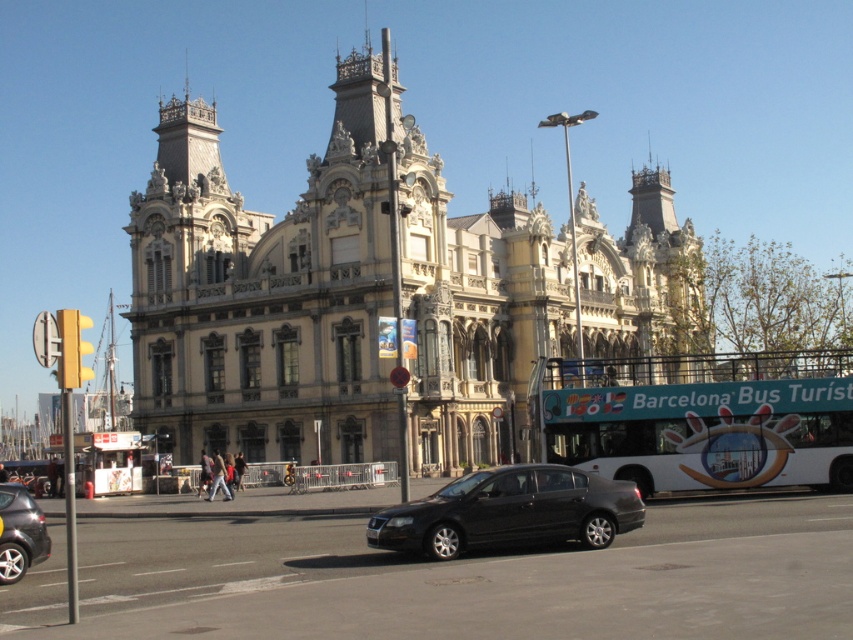
Question: Which point appears closest to the camera in this image?

Choices:
 (A) (692, 244)
 (B) (537, 472)
 (C) (9, 486)

Answer: (C)

Question: Can you confirm if stone textured building at center is positioned above matte black sedan at center?

Choices:
 (A) no
 (B) yes

Answer: (B)

Question: Estimate the real-world distances between objects in this image. Which object is farther from the white glossy bus at lower right?

Choices:
 (A) matte black sedan at center
 (B) metallic gray sedan at lower left
 (C) stone textured building at center

Answer: (B)

Question: Can you confirm if white glossy bus at lower right is wider than matte black sedan at center?

Choices:
 (A) no
 (B) yes

Answer: (B)

Question: From the image, what is the correct spatial relationship of stone textured building at center in relation to white glossy bus at lower right?

Choices:
 (A) below
 (B) above

Answer: (B)

Question: Estimate the real-world distances between objects in this image. Which object is closer to the stone textured building at center?

Choices:
 (A) matte black sedan at center
 (B) white glossy bus at lower right

Answer: (B)